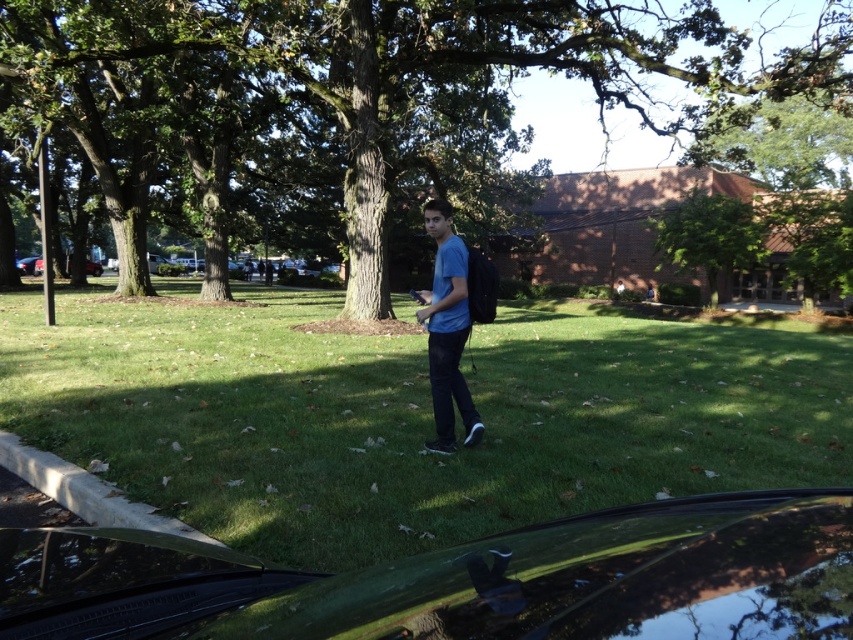
Which is behind, point (434, 413) or point (701, 220)?

The point (701, 220) is behind.

Where is `blue matte shirt at center`? The image size is (853, 640). blue matte shirt at center is located at coordinates (447, 330).

I want to click on blue matte shirt at center, so click(x=447, y=330).

Which is above, green textured tree at center or blue matte shirt at center?

green textured tree at center is above.

The width and height of the screenshot is (853, 640). What do you see at coordinates (367, 108) in the screenshot?
I see `green textured tree at center` at bounding box center [367, 108].

Image resolution: width=853 pixels, height=640 pixels. In order to click on green textured tree at center in this screenshot , I will do `click(367, 108)`.

Who is more distant from viewer, (714, 550) or (741, 211)?

Point (741, 211)

Who is shorter, glossy black car at lower center or green leafy tree at center?

glossy black car at lower center is shorter.

Is point (663, 577) less distant than point (705, 196)?

That is True.

Find the location of `glossy black car at lower center`. glossy black car at lower center is located at coordinates (462, 580).